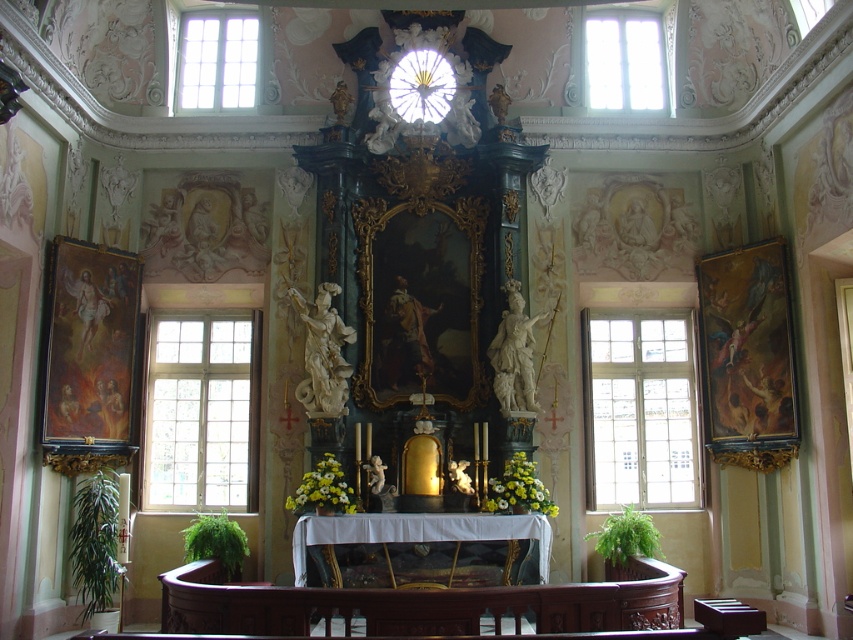
Question: Is clear glass window at left positioned behind clear glass window at upper right?

Choices:
 (A) yes
 (B) no

Answer: (B)

Question: Can you confirm if clear glass window at right is bigger than clear glass window at upper center?

Choices:
 (A) no
 (B) yes

Answer: (B)

Question: Which of the following is the farthest from the observer?

Choices:
 (A) clear glass window at right
 (B) clear glass window at upper right
 (C) clear glass window at left

Answer: (B)

Question: Which is nearer to the clear glass window at left?

Choices:
 (A) clear glass window at right
 (B) clear glass window at upper center
 (C) clear glass window at upper right

Answer: (B)

Question: Estimate the real-world distances between objects in this image. Which object is closer to the clear glass window at upper center?

Choices:
 (A) clear glass window at upper right
 (B) clear glass window at left

Answer: (B)

Question: Does clear glass window at left appear on the right side of clear glass window at upper right?

Choices:
 (A) no
 (B) yes

Answer: (A)